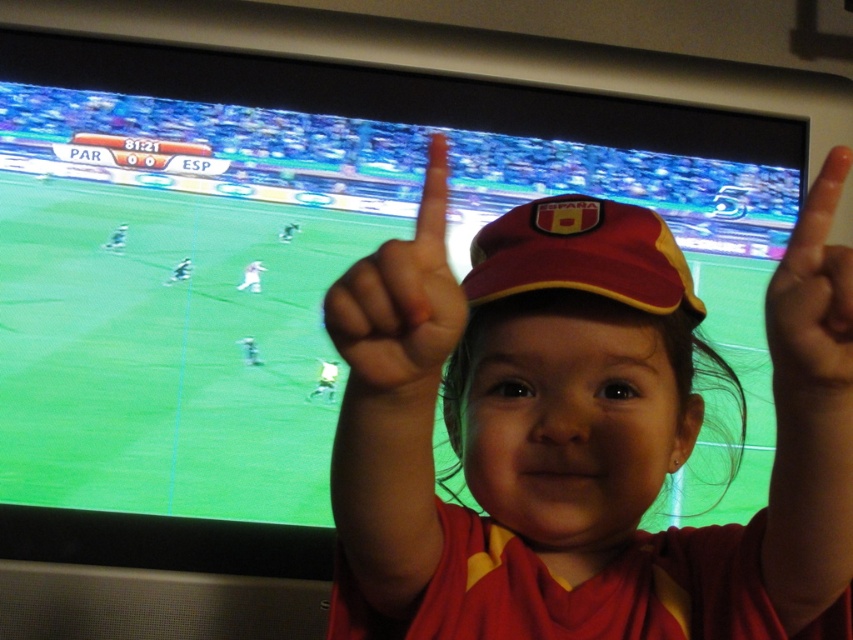
Which is below, matte red cap at center or matte red finger at center?

Positioned lower is matte red cap at center.

Between point (341, 333) and point (357, 380), which one is positioned behind?

The point (357, 380) is behind.

Where is `matte red cap at center`? The height and width of the screenshot is (640, 853). matte red cap at center is located at coordinates (578, 432).

Where is `matte red cap at center`? The width and height of the screenshot is (853, 640). matte red cap at center is located at coordinates (578, 432).

Which is below, matte red finger at center or orange matte finger at upper right?

orange matte finger at upper right

Who is taller, matte red finger at center or orange matte finger at upper right?

orange matte finger at upper right

Is point (369, 289) positioned before point (822, 225)?

That is True.

Locate an element on the screen. This screenshot has height=640, width=853. matte red finger at center is located at coordinates (399, 305).

Between point (381, 397) and point (663, 234), which one is positioned behind?

The point (663, 234) is behind.

Can you confirm if matte red finger at center is smaller than matte red baseball cap at center?

Correct, matte red finger at center occupies less space than matte red baseball cap at center.

Is point (410, 262) farther from viewer compared to point (618, 253)?

No, it is in front of (618, 253).

Where is `matte red finger at center`? matte red finger at center is located at coordinates (399, 305).